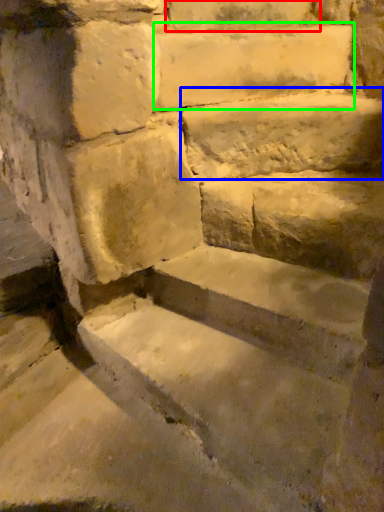
Question: Based on their relative distances, which object is farther from brick (highlighted by a red box)? Choose from limestone (highlighted by a blue box) and limestone (highlighted by a green box).

Choices:
 (A) limestone
 (B) limestone

Answer: (A)